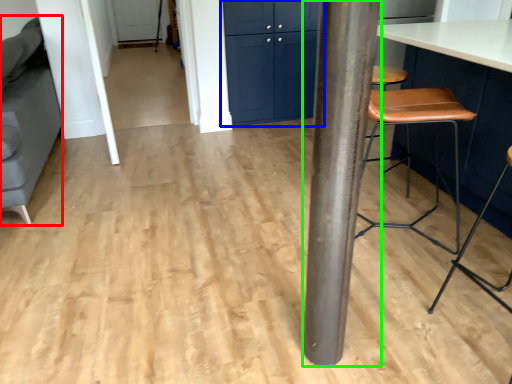
Question: Which object is the farthest from swivel chair (highlighted by a red box)? Choose among these: cabinetry (highlighted by a blue box) or pillar (highlighted by a green box).

Choices:
 (A) cabinetry
 (B) pillar

Answer: (B)